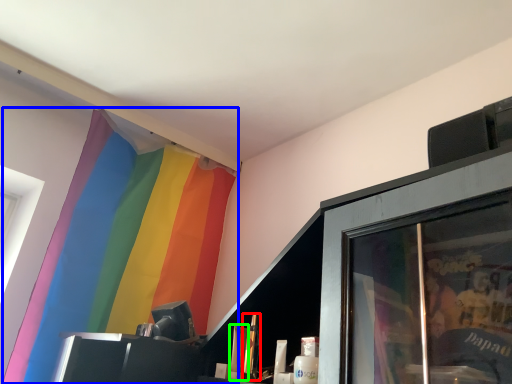
Question: Based on their relative distances, which object is nearer to toiletry (highlighted by a red box)? Choose from curtain (highlighted by a blue box) and toiletry (highlighted by a green box).

Choices:
 (A) curtain
 (B) toiletry

Answer: (B)